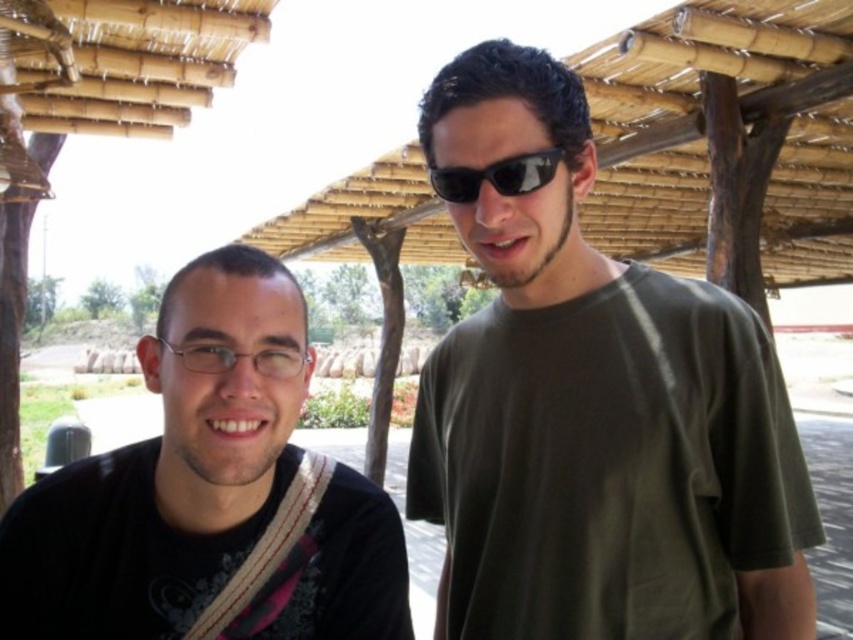
Is point (650, 324) less distant than point (33, 572)?

That is False.

Locate an element on the screen. The width and height of the screenshot is (853, 640). green matte t-shirt at center is located at coordinates (595, 410).

Can you confirm if green matte t-shirt at center is positioned below sunglasses at center?

Correct, green matte t-shirt at center is located below sunglasses at center.

Is green matte t-shirt at center shorter than sunglasses at center?

Incorrect, green matte t-shirt at center's height does not fall short of sunglasses at center's.

Measure the distance between point (x=700, y=604) and camera.

They are 1.63 meters apart.

Identify the location of green matte t-shirt at center. (595, 410).

Does black matte shirt at left have a greater height compared to sunglasses at center?

Yes.

Image resolution: width=853 pixels, height=640 pixels. I want to click on black matte shirt at left, so click(172, 468).

You are a GUI agent. You are given a task and a screenshot of the screen. Output one action in this format:
    pyautogui.click(x=<x>, y=<y>)
    Task: Click on the black matte shirt at left
    This screenshot has height=640, width=853.
    Given the screenshot: What is the action you would take?
    pyautogui.click(x=172, y=468)